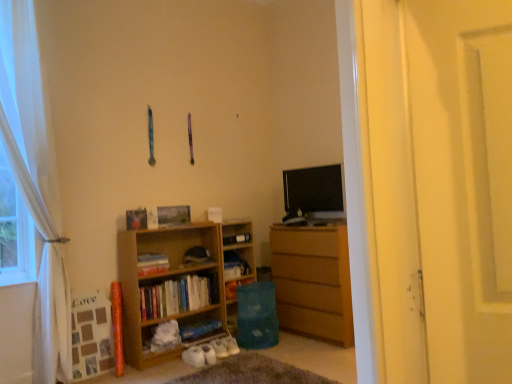
Question: Is wooden chest of drawers at right at the left side of white fluffy slippers at lower center?

Choices:
 (A) no
 (B) yes

Answer: (A)

Question: Is wooden chest of drawers at right shorter than white fluffy slippers at lower center?

Choices:
 (A) no
 (B) yes

Answer: (A)

Question: Could white fluffy slippers at lower center be considered to be inside wooden chest of drawers at right?

Choices:
 (A) no
 (B) yes

Answer: (A)

Question: From a real-world perspective, does wooden chest of drawers at right stand above white fluffy slippers at lower center?

Choices:
 (A) no
 (B) yes

Answer: (B)

Question: Does wooden chest of drawers at right have a lesser width compared to white fluffy slippers at lower center?

Choices:
 (A) yes
 (B) no

Answer: (A)

Question: Is there a large distance between wooden chest of drawers at right and white fluffy slippers at lower center?

Choices:
 (A) yes
 (B) no

Answer: (B)

Question: Does white matte screen door at right have a larger size compared to wooden bookshelf at center?

Choices:
 (A) yes
 (B) no

Answer: (B)

Question: Does white matte screen door at right have a lesser height compared to wooden bookshelf at center?

Choices:
 (A) yes
 (B) no

Answer: (A)

Question: Considering the relative sizes of white matte screen door at right and wooden bookshelf at center in the image provided, is white matte screen door at right wider than wooden bookshelf at center?

Choices:
 (A) no
 (B) yes

Answer: (A)

Question: Is white matte screen door at right turned away from wooden bookshelf at center?

Choices:
 (A) yes
 (B) no

Answer: (B)

Question: Does white matte screen door at right contain wooden bookshelf at center?

Choices:
 (A) yes
 (B) no

Answer: (B)

Question: Would you say white matte screen door at right is a long distance from wooden bookshelf at center?

Choices:
 (A) no
 (B) yes

Answer: (B)

Question: Does blue matte book at lower center, acting as the first book starting from the bottom, lie in front of white sheer curtain at left?

Choices:
 (A) yes
 (B) no

Answer: (B)